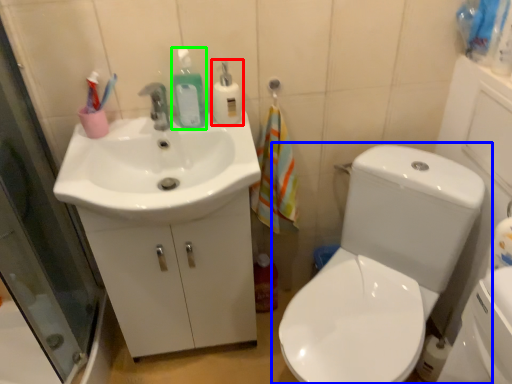
Question: Which object is the farthest from cleaning product (highlighted by a red box)? Choose among these: toilet (highlighted by a blue box) or cleaning product (highlighted by a green box).

Choices:
 (A) toilet
 (B) cleaning product

Answer: (A)